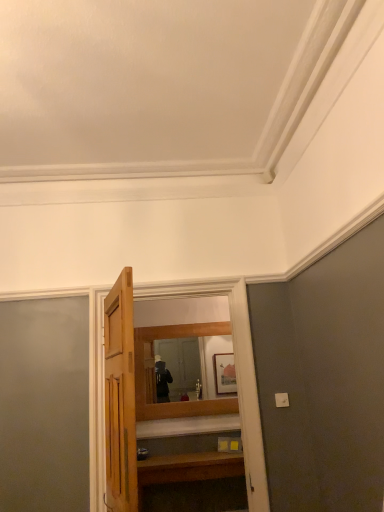
Question: From a real-world perspective, is wooden mirror at center over wooden vanity at lower center?

Choices:
 (A) no
 (B) yes

Answer: (B)

Question: Is wooden mirror at center smaller than wooden vanity at lower center?

Choices:
 (A) yes
 (B) no

Answer: (A)

Question: Is wooden mirror at center positioned behind wooden vanity at lower center?

Choices:
 (A) yes
 (B) no

Answer: (A)

Question: Is wooden mirror at center to the right of wooden vanity at lower center from the viewer's perspective?

Choices:
 (A) no
 (B) yes

Answer: (A)

Question: Is wooden mirror at center positioned far away from wooden vanity at lower center?

Choices:
 (A) yes
 (B) no

Answer: (B)

Question: Is wooden mirror at center not within wooden vanity at lower center?

Choices:
 (A) yes
 (B) no

Answer: (A)

Question: Does wooden mirror at center have a smaller size compared to wooden door at center?

Choices:
 (A) no
 (B) yes

Answer: (B)

Question: Is wooden mirror at center at the left side of wooden door at center?

Choices:
 (A) no
 (B) yes

Answer: (A)

Question: From a real-world perspective, is wooden mirror at center physically above wooden door at center?

Choices:
 (A) no
 (B) yes

Answer: (B)

Question: From the image's perspective, is wooden mirror at center over wooden door at center?

Choices:
 (A) yes
 (B) no

Answer: (B)

Question: Is wooden door at center a part of wooden mirror at center?

Choices:
 (A) yes
 (B) no

Answer: (B)

Question: From a real-world perspective, is wooden mirror at center located beneath wooden door at center?

Choices:
 (A) yes
 (B) no

Answer: (B)

Question: Does wooden vanity at lower center appear on the left side of wooden mirror at center?

Choices:
 (A) no
 (B) yes

Answer: (A)